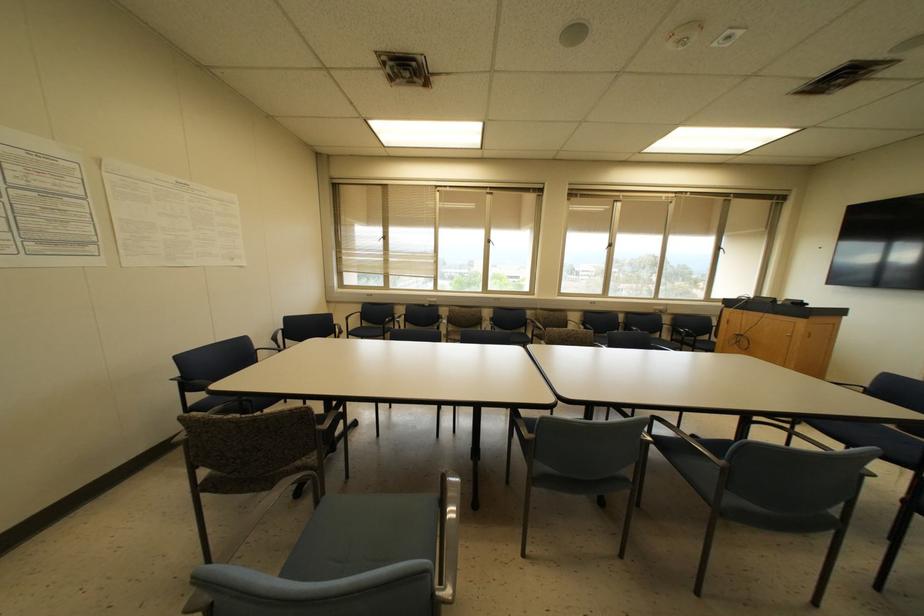
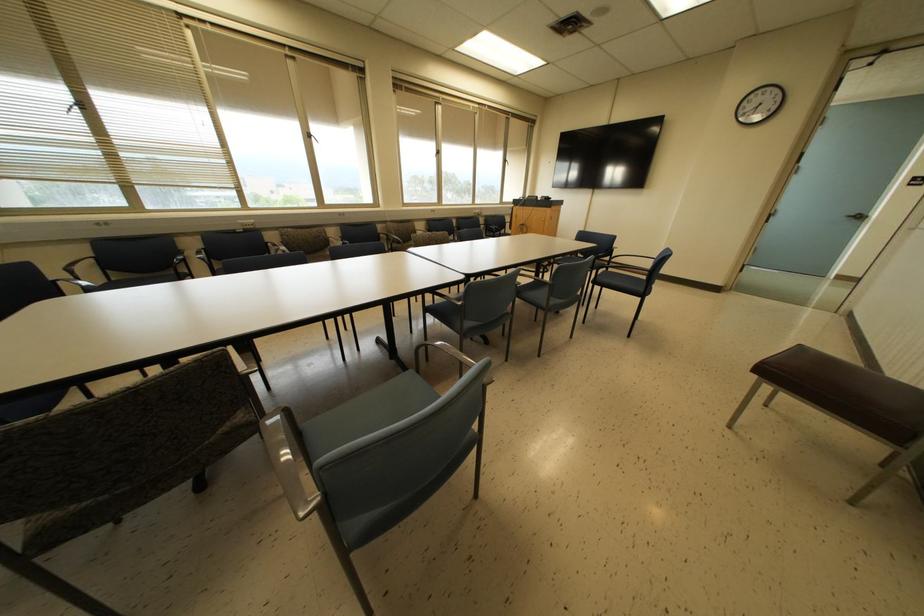
The images are taken continuously from a first-person perspective. In which direction is your viewpoint rotating?

The rotation direction of the camera is right-down.